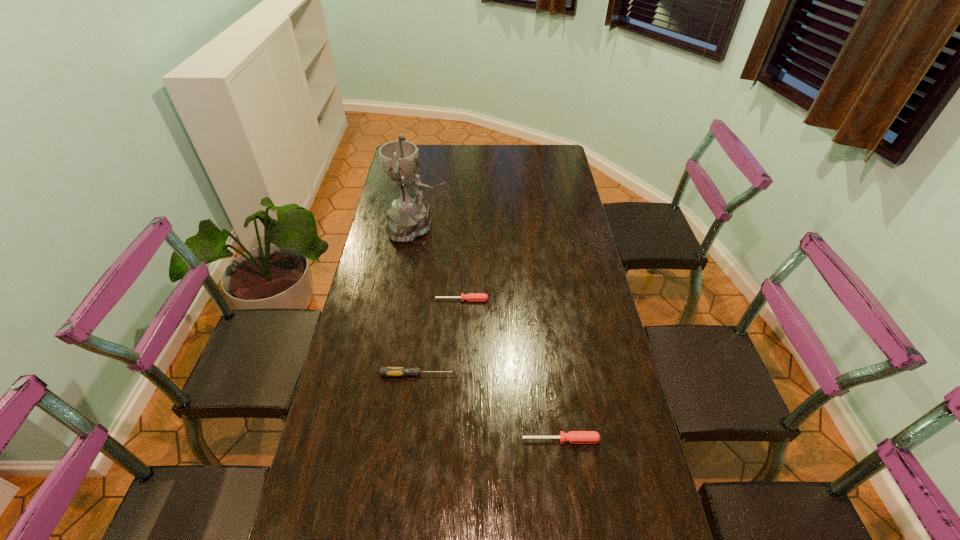
The image size is (960, 540). I want to click on award that is at the left edge, so [407, 219].

The height and width of the screenshot is (540, 960). Find the location of `screwdriver that is at the left edge`. screwdriver that is at the left edge is located at coordinates (384, 371).

This screenshot has width=960, height=540. Identify the location of object at the right edge. (574, 437).

Find the location of a particular element. vacant space at the far edge is located at coordinates (519, 152).

Image resolution: width=960 pixels, height=540 pixels. In order to click on blank space at the left edge of the desktop in this screenshot , I will do `click(356, 303)`.

Locate an element on the screen. The height and width of the screenshot is (540, 960). blank space at the right edge is located at coordinates (579, 221).

I want to click on vacant area between the rightmost screwdriver and the farthest screwdriver, so point(512,370).

This screenshot has width=960, height=540. In order to click on vacant area that lies between the second nearest screwdriver and the farthest screwdriver in this screenshot , I will do `click(440, 338)`.

Identify the location of vacant region between the third nearest object and the second farthest screwdriver. This screenshot has height=540, width=960. (440, 338).

This screenshot has height=540, width=960. I want to click on vacant area that lies between the nearest object and the award, so click(x=490, y=334).